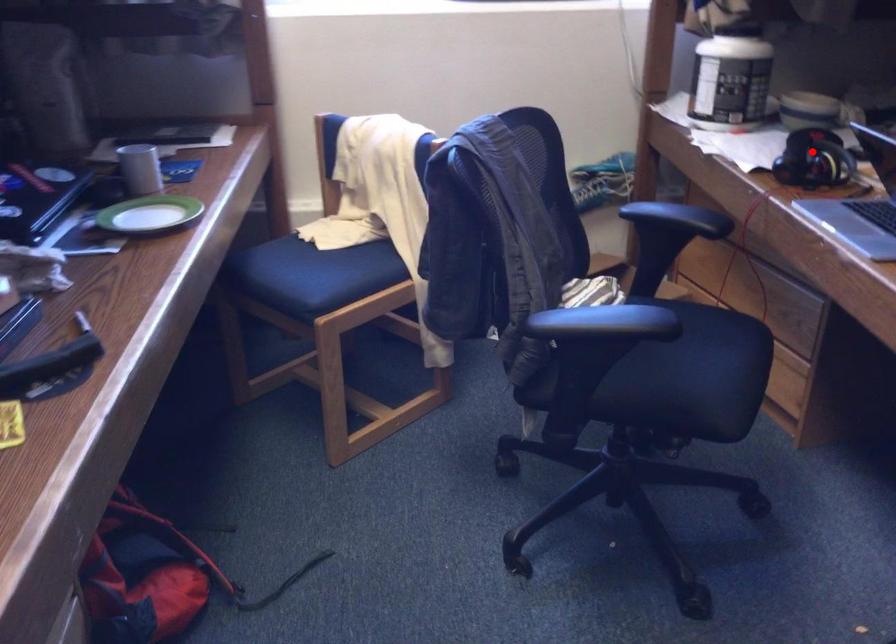
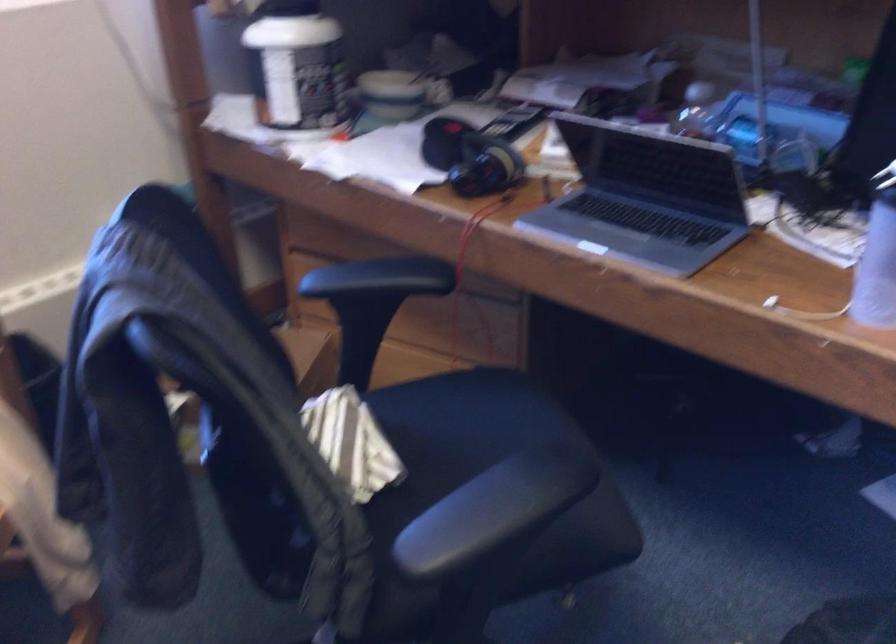
Question: I am providing you with two images of the same scene from different viewpoints. Given a red point in image1, look at the same physical point in image2. Is it:

Choices:
 (A) Closer to the viewpoint
 (B) Farther from the viewpoint

Answer: (A)